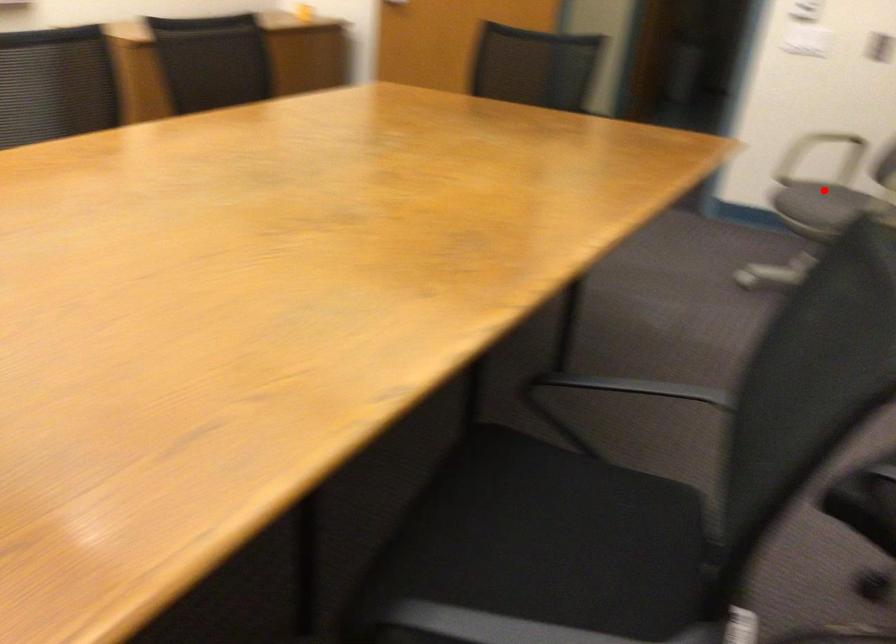
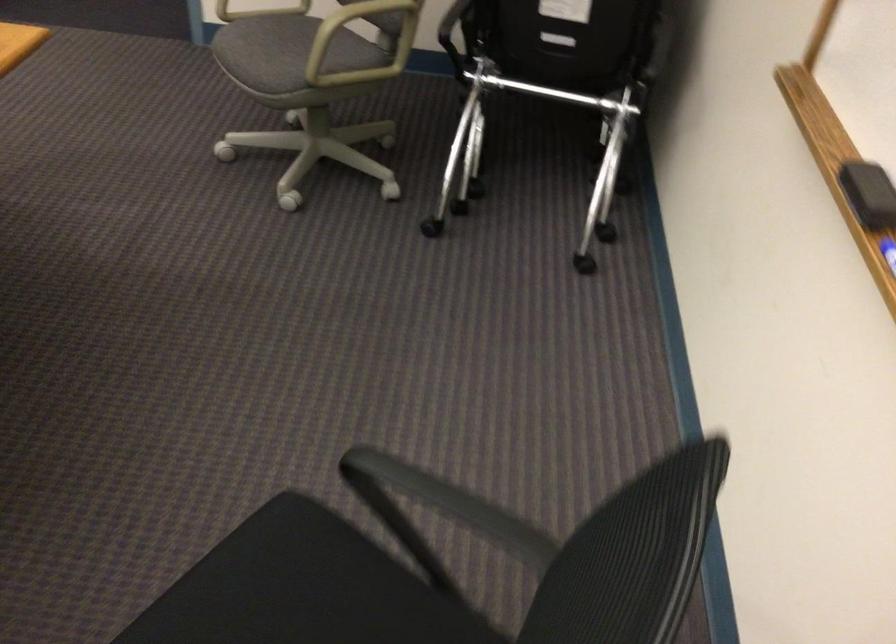
Question: I am providing you with two images of the same scene from different viewpoints. Image1 has a red point marked. In image2, the corresponding 3D location appears at what relative position? Reply with the corresponding letter.

Choices:
 (A) Closer
 (B) Farther

Answer: (A)